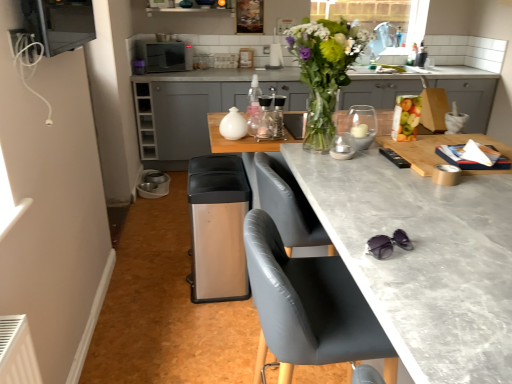
You are a GUI agent. You are given a task and a screenshot of the screen. Output one action in this format:
    pyautogui.click(x=<x>, y=<y>)
    Task: Click on the free space in front of translucent plastic bag of assorted fruits at right
    This screenshot has height=384, width=512.
    Given the screenshot: What is the action you would take?
    pyautogui.click(x=409, y=148)